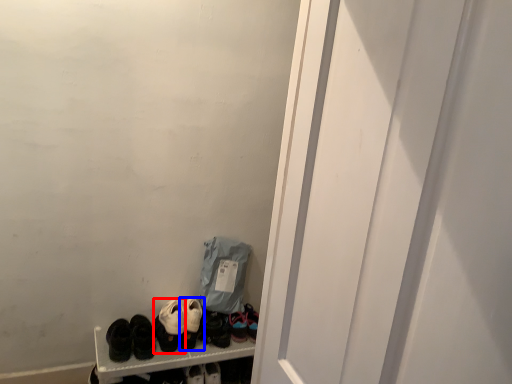
Question: Among these objects, which one is nearest to the camera, footwear (highlighted by a red box) or footwear (highlighted by a blue box)?

Choices:
 (A) footwear
 (B) footwear

Answer: (A)